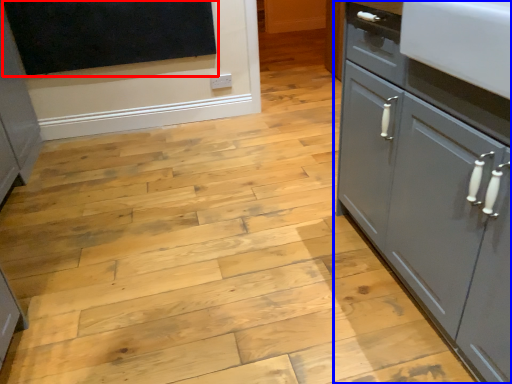
Question: Which object appears closest to the camera in this image, dark (highlighted by a red box) or cupboard (highlighted by a blue box)?

Choices:
 (A) dark
 (B) cupboard

Answer: (B)